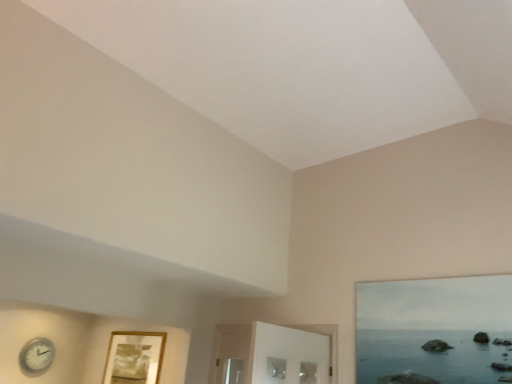
Describe the element at coordinates (134, 357) in the screenshot. The width and height of the screenshot is (512, 384). I see `wooden picture frame at lower left` at that location.

Measure the distance between wooden picture frame at lower left and camera.

wooden picture frame at lower left is 14.69 feet away from camera.

You are a GUI agent. You are given a task and a screenshot of the screen. Output one action in this format:
    pyautogui.click(x=<x>, y=<y>)
    Task: Click on the wooden picture frame at lower left
    Image resolution: width=512 pixels, height=384 pixels.
    Given the screenshot: What is the action you would take?
    pyautogui.click(x=134, y=357)

This screenshot has height=384, width=512. Describe the element at coordinates (37, 355) in the screenshot. I see `white plastic clock at lower left` at that location.

Locate an element on the screen. The image size is (512, 384). white plastic clock at lower left is located at coordinates (37, 355).

You are a GUI agent. You are given a task and a screenshot of the screen. Output one action in this format:
    pyautogui.click(x=<x>, y=<y>)
    Task: Click on the wooden picture frame at lower left
    The width and height of the screenshot is (512, 384).
    Given the screenshot: What is the action you would take?
    pos(134,357)

From the picture: Which is more to the left, wooden picture frame at lower left or white plastic clock at lower left?

From the viewer's perspective, white plastic clock at lower left appears more on the left side.

Between wooden picture frame at lower left and white plastic clock at lower left, which one is positioned behind?

white plastic clock at lower left is further away from the camera.

Between point (157, 342) and point (52, 347), which one is positioned in front?

Positioned in front is point (157, 342).

From the image's perspective, which object appears higher, wooden picture frame at lower left or white plastic clock at lower left?

From the image's view, wooden picture frame at lower left is above.

Looking at this image, from a real-world perspective, which is physically below, wooden picture frame at lower left or white plastic clock at lower left?

white plastic clock at lower left.

Which object is wider, wooden picture frame at lower left or white plastic clock at lower left?

With larger width is white plastic clock at lower left.

Who is taller, wooden picture frame at lower left or white plastic clock at lower left?

wooden picture frame at lower left is taller.

Between wooden picture frame at lower left and white plastic clock at lower left, which one has smaller size?

Smaller between the two is white plastic clock at lower left.

Would you say wooden picture frame at lower left contains white plastic clock at lower left?

No, white plastic clock at lower left is located outside of wooden picture frame at lower left.

Is wooden picture frame at lower left next to white plastic clock at lower left and touching it?

No, wooden picture frame at lower left is not making contact with white plastic clock at lower left.

Consider the image. Could you tell me if wooden picture frame at lower left is facing white plastic clock at lower left?

No, wooden picture frame at lower left is not oriented towards white plastic clock at lower left.

How much distance is there between wooden picture frame at lower left and white plastic clock at lower left?

wooden picture frame at lower left and white plastic clock at lower left are 32.91 inches apart.

This screenshot has width=512, height=384. In order to click on picture frame lying in front of the white plastic clock at lower left in this screenshot , I will do `click(134, 357)`.

Considering the relative positions of white plastic clock at lower left and wooden picture frame at lower left in the image provided, is white plastic clock at lower left to the left or to the right of wooden picture frame at lower left?

white plastic clock at lower left is to the left of wooden picture frame at lower left.

Considering the relative positions of white plastic clock at lower left and wooden picture frame at lower left in the image provided, is white plastic clock at lower left behind wooden picture frame at lower left?

Yes.

Is point (21, 350) positioned behind point (154, 365)?

That is False.

From the image's perspective, which is above, white plastic clock at lower left or wooden picture frame at lower left?

wooden picture frame at lower left is shown above in the image.

From a real-world perspective, between white plastic clock at lower left and wooden picture frame at lower left, who is vertically higher?

wooden picture frame at lower left.

Between white plastic clock at lower left and wooden picture frame at lower left, which one has larger width?

white plastic clock at lower left.

From the picture: Is white plastic clock at lower left taller than wooden picture frame at lower left?

No, white plastic clock at lower left is not taller than wooden picture frame at lower left.

Considering the sizes of objects white plastic clock at lower left and wooden picture frame at lower left in the image provided, who is smaller, white plastic clock at lower left or wooden picture frame at lower left?

With smaller size is white plastic clock at lower left.

Is white plastic clock at lower left not inside wooden picture frame at lower left?

Yes, white plastic clock at lower left is outside of wooden picture frame at lower left.

Would you consider white plastic clock at lower left to be distant from wooden picture frame at lower left?

Actually, white plastic clock at lower left and wooden picture frame at lower left are a little close together.

Is white plastic clock at lower left positioned with its back to wooden picture frame at lower left?

No, white plastic clock at lower left is not facing away from wooden picture frame at lower left.

What's the angular difference between white plastic clock at lower left and wooden picture frame at lower left's facing directions?

The angular difference between white plastic clock at lower left and wooden picture frame at lower left is 90 degrees.

The height and width of the screenshot is (384, 512). I want to click on clock behind the wooden picture frame at lower left, so click(x=37, y=355).

Locate an element on the screen. This screenshot has width=512, height=384. clock behind the wooden picture frame at lower left is located at coordinates (37, 355).

This screenshot has height=384, width=512. Identify the location of picture frame above the white plastic clock at lower left (from the image's perspective). (134, 357).